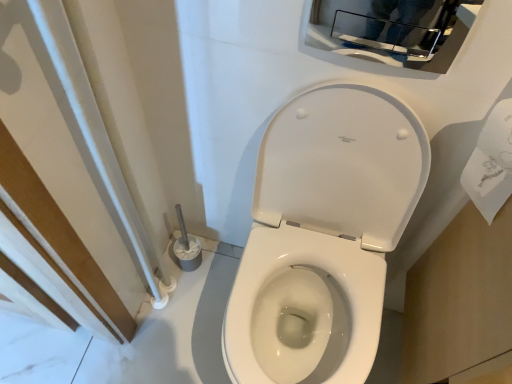
Question: Is white paper towel at right to the left or to the right of glossy chrome medicine cabinet at upper center in the image?

Choices:
 (A) right
 (B) left

Answer: (A)

Question: From a real-world perspective, is white paper towel at right above or below glossy chrome medicine cabinet at upper center?

Choices:
 (A) above
 (B) below

Answer: (B)

Question: Based on their relative distances, which object is nearer to the white glossy toilet at center?

Choices:
 (A) white paper towel at right
 (B) glossy chrome medicine cabinet at upper center

Answer: (A)

Question: Estimate the real-world distances between objects in this image. Which object is farther from the white paper towel at right?

Choices:
 (A) glossy chrome medicine cabinet at upper center
 (B) white glossy toilet at center

Answer: (B)